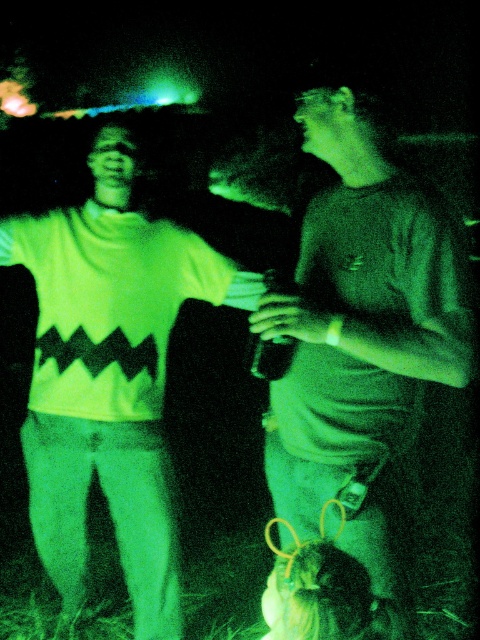
From the picture: Between matte gray t-shirt at right and white matte sweater at left, which one is positioned lower?

white matte sweater at left is below.

Between matte gray t-shirt at right and white matte sweater at left, which one has more height?

With more height is white matte sweater at left.

Is point (363, 292) farther from camera compared to point (43, 509)?

No, it is not.

Find the location of a particular element. The image size is (480, 640). matte gray t-shirt at right is located at coordinates (360, 324).